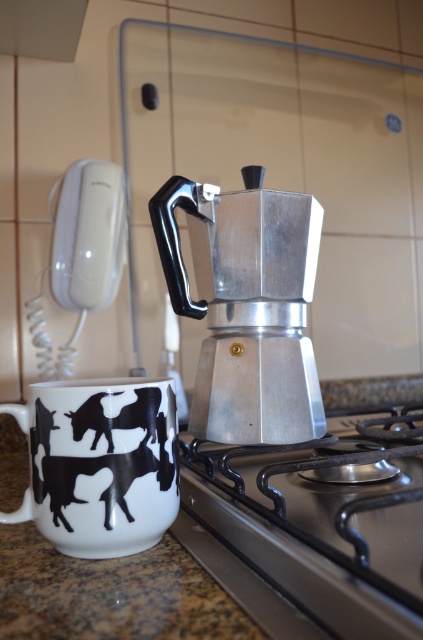
You are standing in the kitchen and want to place a new spice jar on the granite countertop at lower left. However, there is already a silver metallic coffee maker at center in the way. Based on their positions, which object is closer to the right edge of the countertop?

The silver metallic coffee maker at center is closer to the right edge of the countertop because it is positioned to the right of the granite countertop at lower left.

You are standing in the kitchen and want to place a small spice jar between the two points marked as point [236,394] and point [172,544]. Which point should the spice jar be closer to if you want it to be closer to the viewer?

The spice jar should be closer to point [236,394] because it is further to the viewer than point [172,544].